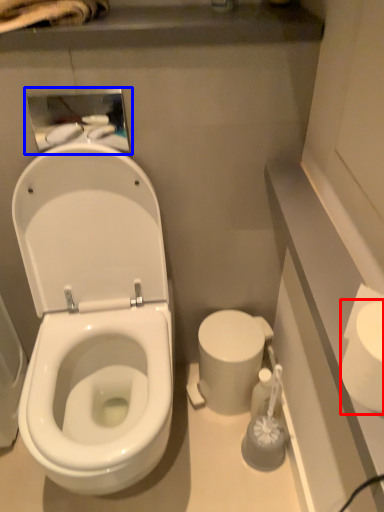
Question: Which object appears farthest to the camera in this image, toilet paper (highlighted by a red box) or medicine cabinet (highlighted by a blue box)?

Choices:
 (A) toilet paper
 (B) medicine cabinet

Answer: (B)